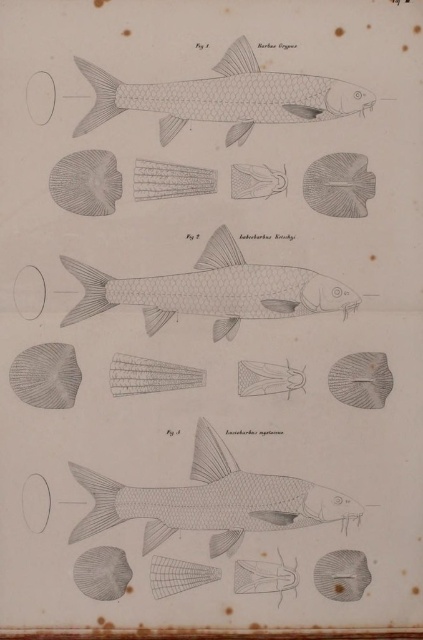
Is smooth gray fish at center below gray textured fish at center?

Correct, smooth gray fish at center is located below gray textured fish at center.

Describe the element at coordinates (211, 500) in the screenshot. I see `smooth gray fish at center` at that location.

Between point (99, 506) and point (63, 348), which one is positioned in front?

Point (99, 506) is in front.

The width and height of the screenshot is (423, 640). I want to click on smooth gray fish at center, so click(x=211, y=500).

Does smooth gray fish at center appear on the right side of matte gray fish at center right?

In fact, smooth gray fish at center is to the left of matte gray fish at center right.

Identify the location of smooth gray fish at center. The height and width of the screenshot is (640, 423). (211, 500).

Who is more distant from viewer, (186, 276) or (68, 404)?

Point (186, 276)

Is grayish silver fish at center taller than gray textured fish at center?

Yes, grayish silver fish at center is taller than gray textured fish at center.

Find the location of a particular element. The height and width of the screenshot is (640, 423). grayish silver fish at center is located at coordinates (213, 291).